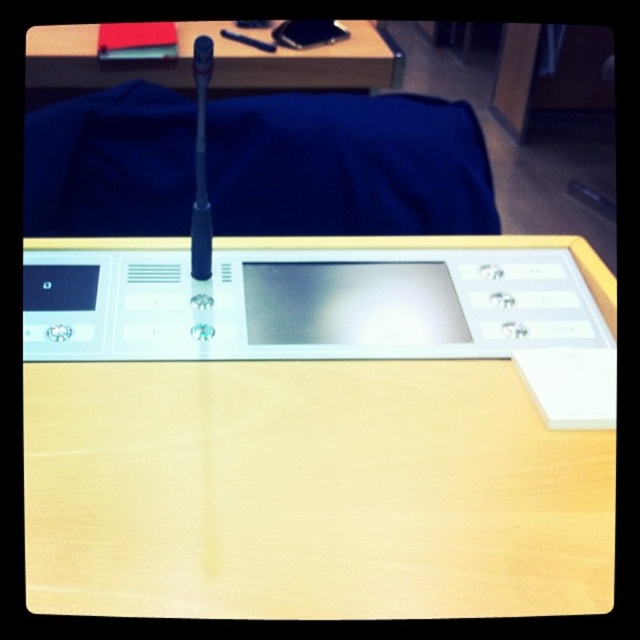
You are an engineer inspecting the desk setup. You need to determine if the blue fabric at center can completely cover the wooden table at upper center. Based on their sizes, what do you conclude?

The blue fabric at center is much taller than the wooden table at upper center, so it can completely cover the wooden table at upper center.

You are standing in front of the desk and want to place a small object exactly at the point marked by coordinates point (310, 428). According to the scene description, where would this point be located?

The point (310, 428) corresponds to the light wood table at center, so placing the object there would position it on the light wood table at center.

You are an astronaut on the International Space Station and need to secure an object. You see the light wood table at center and the blue fabric at center. Which object is located lower in the scene?

The light wood table at center is below blue fabric at center, so the light wood table at center is located lower.